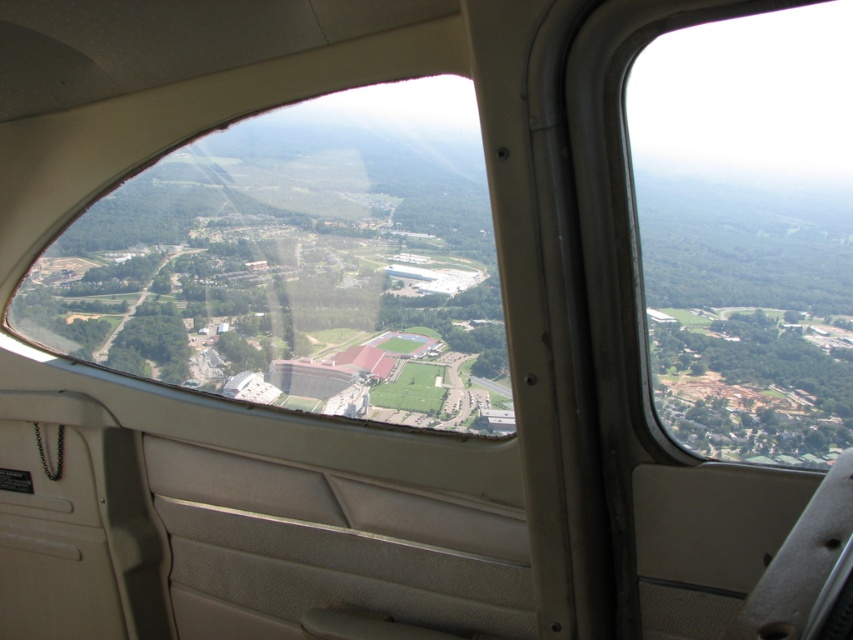
You are a passenger sitting in the aircraft and looking out the window. You notice two points marked in the scene. Which point, point (454,211) or point (677,332), is closer to you?

Point (454,211) is closer to the camera than point (677,332).